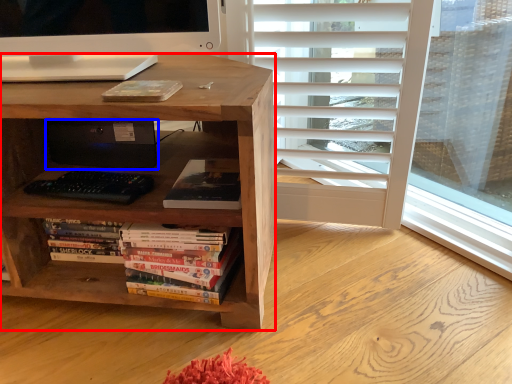
Question: Which of the following is the farthest to the observer, desk (highlighted by a red box) or computer (highlighted by a blue box)?

Choices:
 (A) desk
 (B) computer

Answer: (B)